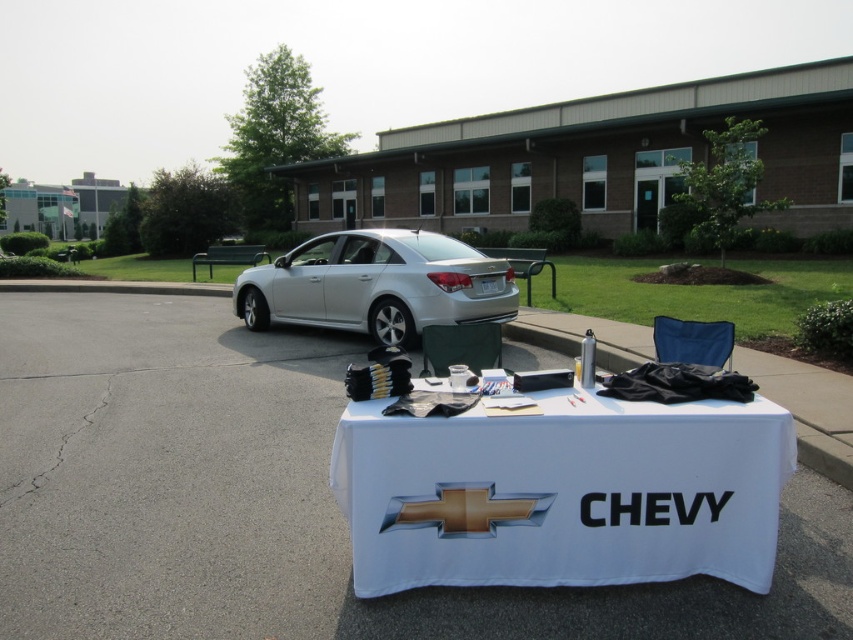
Which of these two, white fabric table at center or silver metallic sedan at center, stands shorter?

white fabric table at center is shorter.

Does point (479, 476) come in front of point (376, 317)?

Yes, it is.

Locate an element on the screen. white fabric table at center is located at coordinates (561, 492).